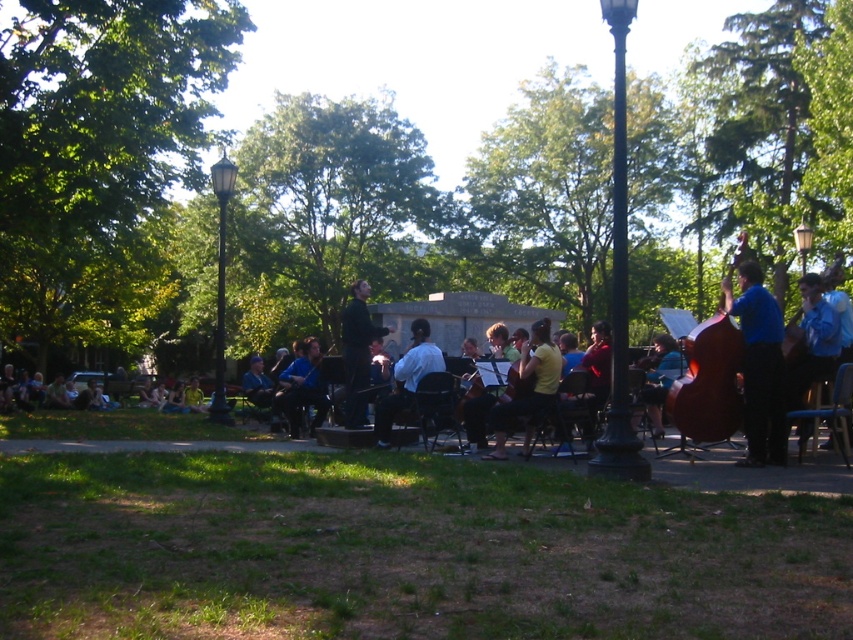
Question: Where is blue fabric shirt at right located in relation to black glass lamp post at center in the image?

Choices:
 (A) below
 (B) above

Answer: (A)

Question: Is blue fabric bass at right to the right of black glass lamp post at center from the viewer's perspective?

Choices:
 (A) yes
 (B) no

Answer: (A)

Question: Which object is closer to the camera taking this photo?

Choices:
 (A) black matte conductor at center
 (B) light blue shirt at center
 (C) yellow matte shirt at center

Answer: (C)

Question: Estimate the real-world distances between objects in this image. Which object is closer to the blue fabric jacket at center?

Choices:
 (A) black glass lamp post at center
 (B) blue fabric shirt at right

Answer: (B)

Question: Is black metal lamp post at center behind blue fabric cello at center?

Choices:
 (A) no
 (B) yes

Answer: (A)

Question: Which of the following is the farthest from the observer?

Choices:
 (A) (352, 300)
 (B) (669, 419)

Answer: (A)